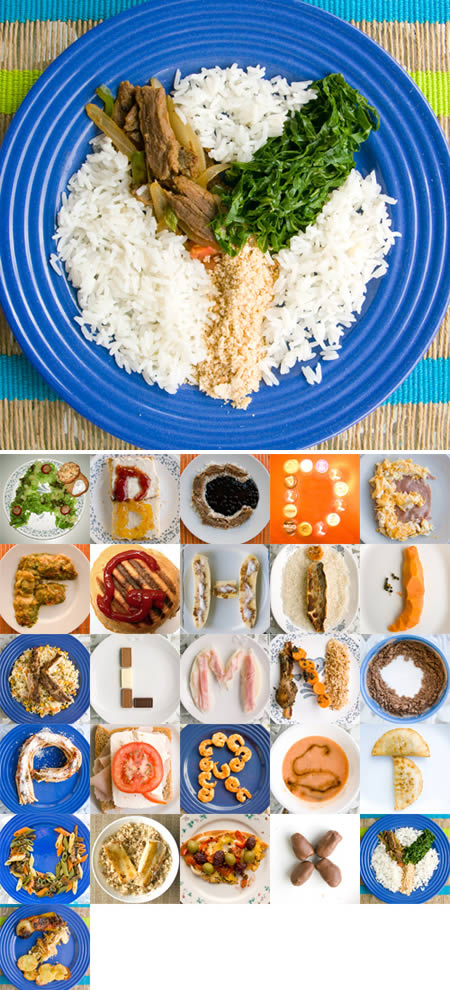
The width and height of the screenshot is (450, 990). I want to click on blue plates, so click(227, 47), click(74, 709), click(72, 789), click(186, 755), click(383, 713), click(394, 822), click(43, 824), click(75, 952).